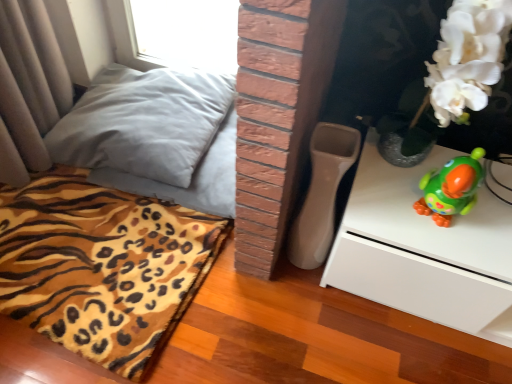
Describe the element at coordinates (102, 266) in the screenshot. I see `leopard print fabric at lower left` at that location.

Measure the distance between leopard print fabric at lower left and camera.

leopard print fabric at lower left is 1.14 meters from camera.

Identify the location of leopard print fabric at lower left. (102, 266).

Locate an element on the screen. leopard print fabric at lower left is located at coordinates (102, 266).